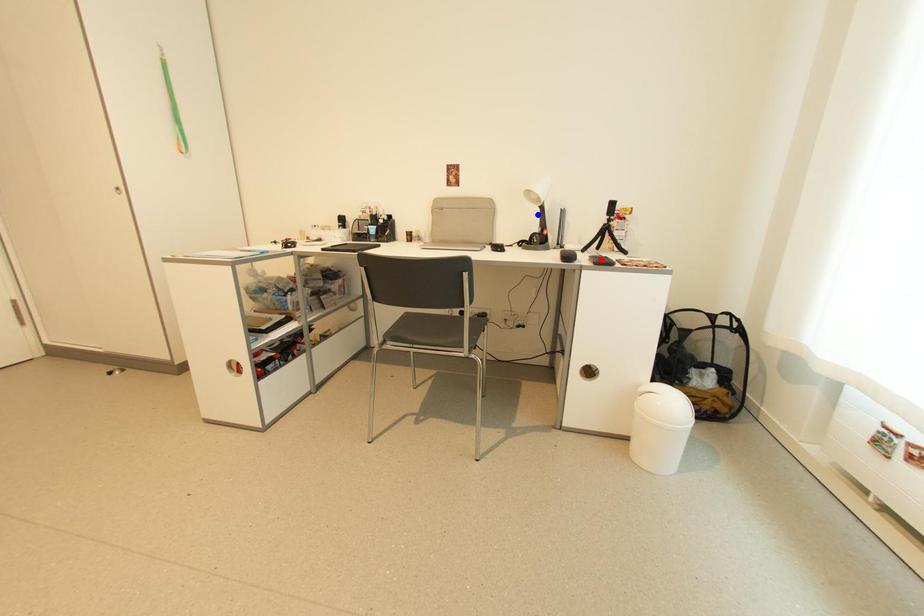
Question: Which of the two points in the image is closer to the camera?

Choices:
 (A) Blue point is closer.
 (B) Red point is closer.

Answer: (B)